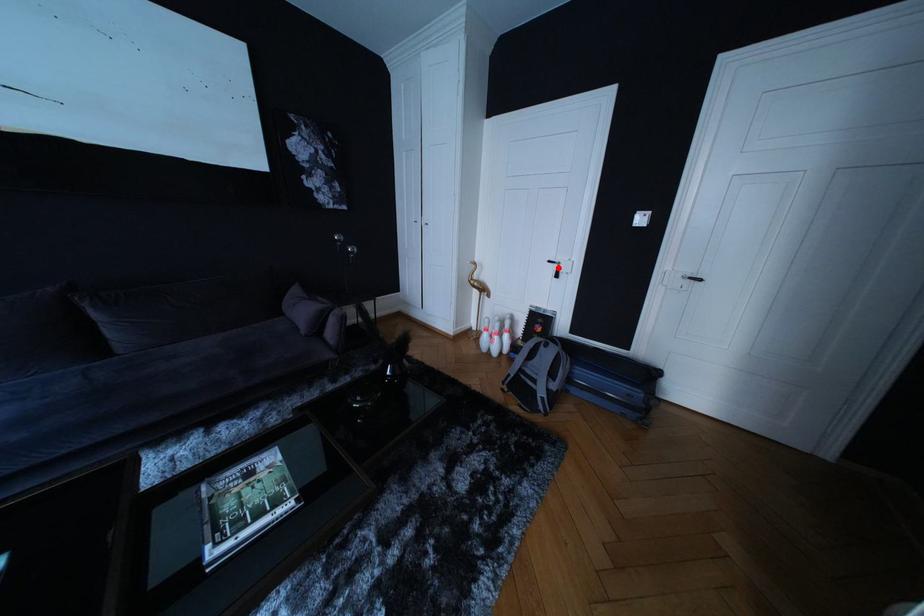
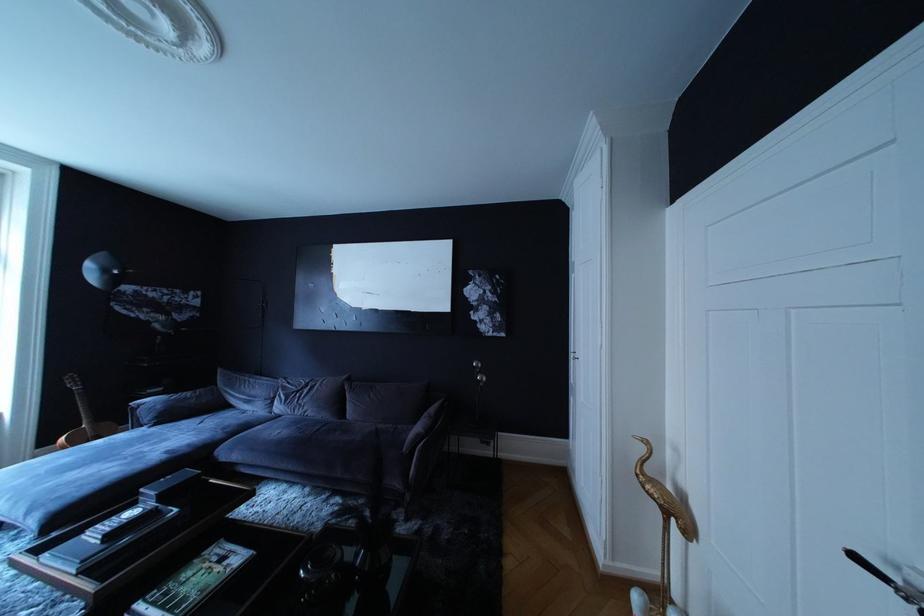
Where in the second image is the point corresponding to the highlighted location from the first image?

(867, 565)